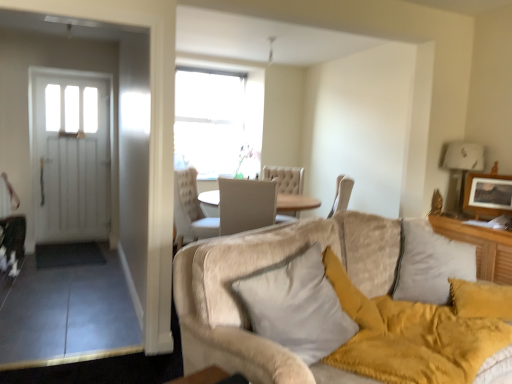
Question: Should I look upward or downward to see white soft pillow at center?

Choices:
 (A) down
 (B) up

Answer: (A)

Question: Does wooden picture frame at upper right have a smaller size compared to white soft pillow at center?

Choices:
 (A) yes
 (B) no

Answer: (A)

Question: Is wooden picture frame at upper right in contact with white soft pillow at center?

Choices:
 (A) yes
 (B) no

Answer: (B)

Question: Would you say white soft pillow at center is part of wooden picture frame at upper right's contents?

Choices:
 (A) yes
 (B) no

Answer: (B)

Question: Can you confirm if wooden picture frame at upper right is bigger than white soft pillow at center?

Choices:
 (A) yes
 (B) no

Answer: (B)

Question: Is wooden picture frame at upper right positioned in front of white soft pillow at center?

Choices:
 (A) yes
 (B) no

Answer: (B)

Question: Does wooden picture frame at upper right have a greater height compared to white soft pillow at center?

Choices:
 (A) no
 (B) yes

Answer: (A)

Question: Considering the relative sizes of white soft pillow at center and beige plush couch at lower right in the image provided, is white soft pillow at center thinner than beige plush couch at lower right?

Choices:
 (A) yes
 (B) no

Answer: (A)

Question: Is white soft pillow at center surrounding beige plush couch at lower right?

Choices:
 (A) no
 (B) yes

Answer: (A)

Question: Does white soft pillow at center come in front of beige plush couch at lower right?

Choices:
 (A) yes
 (B) no

Answer: (B)

Question: Is white soft pillow at center not within beige plush couch at lower right?

Choices:
 (A) yes
 (B) no

Answer: (A)

Question: Considering the relative sizes of white soft pillow at center and beige plush couch at lower right in the image provided, is white soft pillow at center shorter than beige plush couch at lower right?

Choices:
 (A) no
 (B) yes

Answer: (A)

Question: Is beige plush couch at lower right at the back of white soft pillow at center?

Choices:
 (A) yes
 (B) no

Answer: (A)

Question: Is wooden picture frame at upper right positioned in front of beige plush couch at lower right?

Choices:
 (A) yes
 (B) no

Answer: (B)